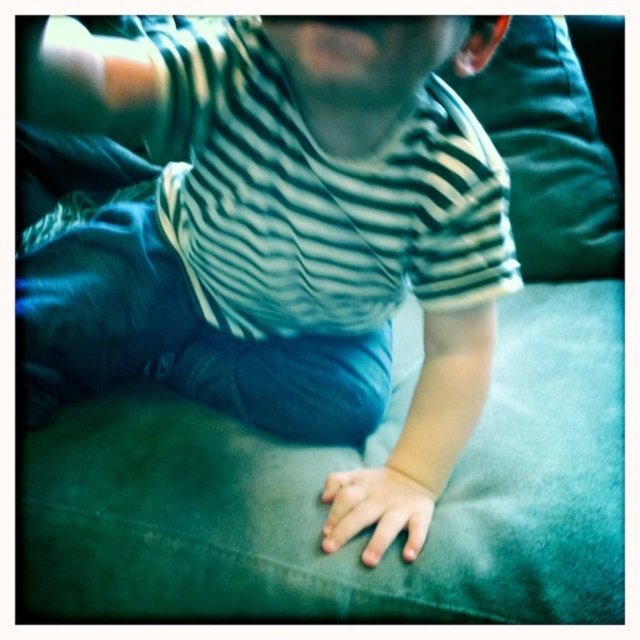
Which is more to the left, striped cotton shirt at center or green fabric pillow at upper right?

striped cotton shirt at center is more to the left.

Which of these two, striped cotton shirt at center or green fabric pillow at upper right, stands shorter?

green fabric pillow at upper right is shorter.

Is point (240, 72) positioned in front of point (538, 54)?

Yes, point (240, 72) is in front of point (538, 54).

Find the location of a particular element. This screenshot has width=640, height=640. striped cotton shirt at center is located at coordinates (298, 198).

Is green fabric pillow at upper right in front of smooth skin hand at center?

No, green fabric pillow at upper right is further to the viewer.

Does green fabric pillow at upper right appear under smooth skin hand at center?

Incorrect, green fabric pillow at upper right is not positioned below smooth skin hand at center.

Locate an element on the screen. The height and width of the screenshot is (640, 640). green fabric pillow at upper right is located at coordinates (548, 152).

Does point (182, 163) come farther from viewer compared to point (397, 465)?

Yes, it is.

Is striped cotton shirt at center in front of smooth skin hand at center?

That is True.

Looking at this image, measure the distance between point (x=355, y=198) and camera.

Point (x=355, y=198) is 23.85 inches away from camera.

Locate an element on the screen. This screenshot has height=640, width=640. striped cotton shirt at center is located at coordinates [298, 198].